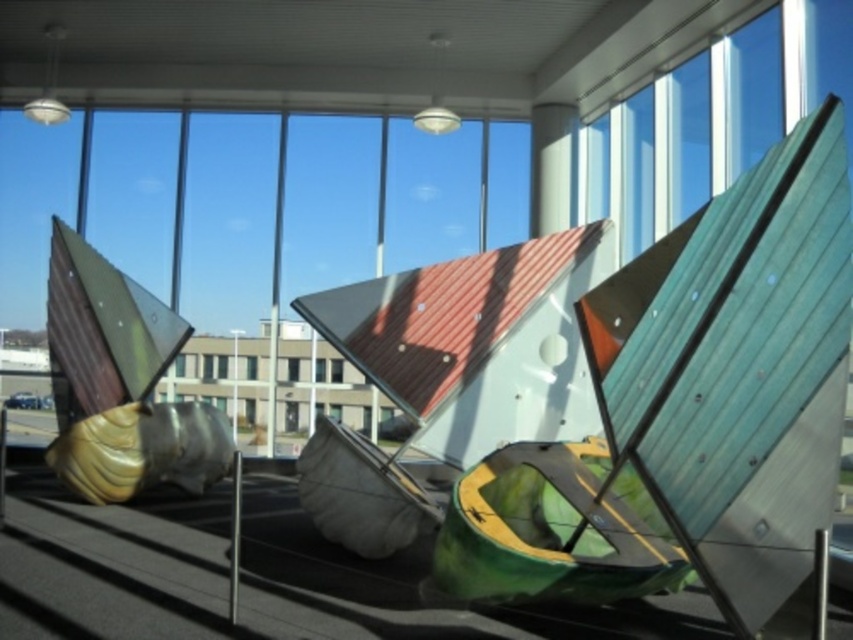
Can you confirm if gold metallic sculpture at left is positioned to the left of transparent glass window at center?

Indeed, gold metallic sculpture at left is positioned on the left side of transparent glass window at center.

At what (x,y) coordinates should I click in order to perform the action: click on gold metallic sculpture at left. Please return your answer as a coordinate pair (x, y). The height and width of the screenshot is (640, 853). Looking at the image, I should click on (120, 384).

Which is in front, point (103, 368) or point (334, 369)?

Point (103, 368) is in front.

Image resolution: width=853 pixels, height=640 pixels. I want to click on gold metallic sculpture at left, so click(120, 384).